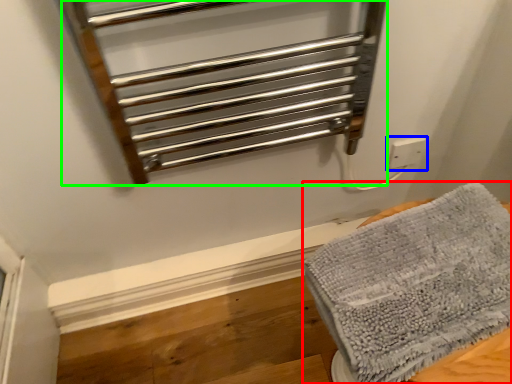
Question: Which object is positioned farthest from towel (highlighted by a red box)? Select from electric outlet (highlighted by a blue box) and cage (highlighted by a green box).

Choices:
 (A) electric outlet
 (B) cage

Answer: (A)